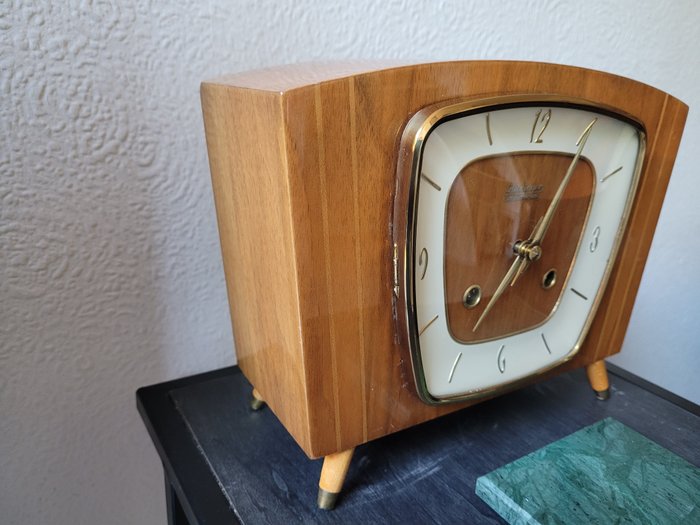
The image size is (700, 525). Identify the location of round bronze screw holes on face of clock. (546, 285), (470, 296).